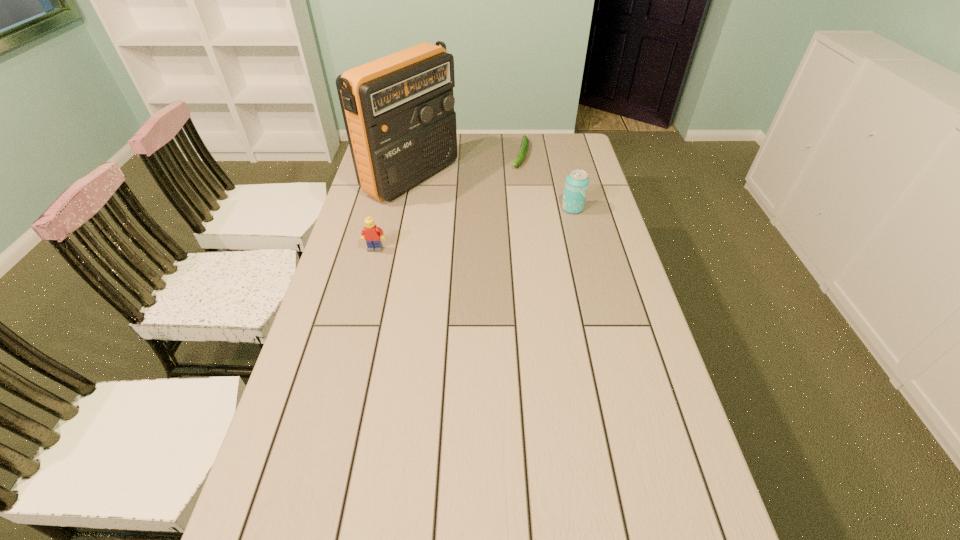
At what (x,y) coordinates should I click in order to perform the action: click on free location located 0.200m on the front-facing side of the radio receiver. Please return your answer as a coordinate pair (x, y). The height and width of the screenshot is (540, 960). Looking at the image, I should click on (488, 217).

This screenshot has width=960, height=540. I want to click on vacant position located 0.120m on the front-facing side of the radio receiver, so point(469,208).

Identify the location of free spot located 0.370m on the front-facing side of the radio receiver. This screenshot has height=540, width=960. (528, 237).

Where is `zucchini that is at the far edge`? zucchini that is at the far edge is located at coordinates (524, 147).

Where is `radio receiver present at the far edge`? This screenshot has height=540, width=960. radio receiver present at the far edge is located at coordinates (398, 110).

Find the location of a particular element. This screenshot has width=960, height=540. Lego that is at the left edge is located at coordinates tap(371, 233).

Locate an element on the screen. The width and height of the screenshot is (960, 540). radio receiver at the left edge is located at coordinates (398, 110).

Locate an element on the screen. The width and height of the screenshot is (960, 540). object situated at the right edge is located at coordinates (577, 181).

I want to click on object that is positioned at the far left corner, so click(x=398, y=110).

Locate an element on the screen. This screenshot has height=540, width=960. free space at the far edge is located at coordinates (533, 155).